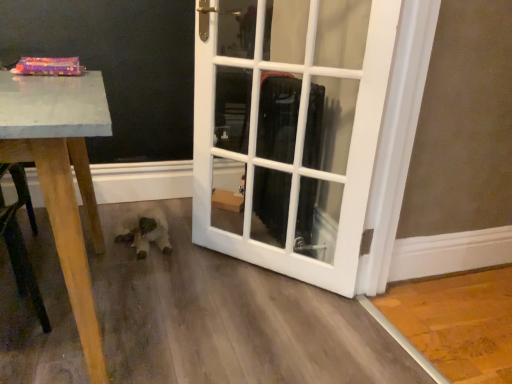
The width and height of the screenshot is (512, 384). I want to click on white glossy door at center, so click(x=289, y=130).

What do you see at coordinates (289, 130) in the screenshot? I see `white glossy door at center` at bounding box center [289, 130].

This screenshot has height=384, width=512. Identify the location of white plush toy at lower center. (144, 231).

Measure the distance between white plush toy at lower center and camera.

white plush toy at lower center is 5.92 feet from camera.

The image size is (512, 384). What do you see at coordinates (144, 231) in the screenshot?
I see `white plush toy at lower center` at bounding box center [144, 231].

What are the coordinates of `white glossy door at center` in the screenshot? It's located at (289, 130).

Between white plush toy at lower center and white glossy door at center, which one appears on the right side from the viewer's perspective?

From the viewer's perspective, white glossy door at center appears more on the right side.

Is the position of white plush toy at lower center less distant than that of white glossy door at center?

No, white plush toy at lower center is behind white glossy door at center.

Considering the points (162, 247) and (244, 18), which point is in front, point (162, 247) or point (244, 18)?

The point (162, 247) is closer.

From the image's perspective, relative to white glossy door at center, is white plush toy at lower center above or below?

Clearly, from the image's perspective, white plush toy at lower center is below white glossy door at center.

In the scene shown: From a real-world perspective, between white plush toy at lower center and white glossy door at center, who is vertically higher?

In real-world perspective, white glossy door at center is above.

Considering the sizes of objects white plush toy at lower center and white glossy door at center in the image provided, who is thinner, white plush toy at lower center or white glossy door at center?

Thinner between the two is white glossy door at center.

Considering the sizes of white plush toy at lower center and white glossy door at center in the image, is white plush toy at lower center taller or shorter than white glossy door at center?

In the image, white plush toy at lower center appears to be shorter than white glossy door at center.

Considering the sizes of objects white plush toy at lower center and white glossy door at center in the image provided, who is bigger, white plush toy at lower center or white glossy door at center?

Bigger between the two is white glossy door at center.

Is white plush toy at lower center surrounding white glossy door at center?

Definitely not — white glossy door at center is not inside white plush toy at lower center.

Are white plush toy at lower center and white glossy door at center far apart?

No, white plush toy at lower center is in close proximity to white glossy door at center.

Is white plush toy at lower center facing towards white glossy door at center?

No.

Can you tell me how much white plush toy at lower center and white glossy door at center differ in facing direction?

white plush toy at lower center and white glossy door at center are facing 47.8 degrees away from each other.

Measure the distance between white plush toy at lower center and white glossy door at center.

They are 25.52 inches apart.

The image size is (512, 384). In the image, there is a white glossy door at center. Find the location of `animal below it (from the image's perspective)`. animal below it (from the image's perspective) is located at coordinates (144, 231).

Can you confirm if white glossy door at center is positioned to the right of white plush toy at lower center?

Yes, white glossy door at center is to the right of white plush toy at lower center.

Which object is closer to the camera, white glossy door at center or white plush toy at lower center?

white glossy door at center.

Considering the positions of point (333, 209) and point (157, 217), is point (333, 209) closer or farther from the camera than point (157, 217)?

Point (333, 209) is positioned closer to the camera compared to point (157, 217).

From the image's perspective, is white glossy door at center located above or below white plush toy at lower center?

white glossy door at center is situated higher than white plush toy at lower center in the image.

From a real-world perspective, is white glossy door at center positioned under white plush toy at lower center based on gravity?

No.

Is white glossy door at center thinner than white plush toy at lower center?

Yes.

Is white glossy door at center taller or shorter than white plush toy at lower center?

Clearly, white glossy door at center is taller compared to white plush toy at lower center.

Considering the relative sizes of white glossy door at center and white plush toy at lower center in the image provided, is white glossy door at center smaller than white plush toy at lower center?

Actually, white glossy door at center might be larger than white plush toy at lower center.

Is white plush toy at lower center completely or partially inside white glossy door at center?

No, white plush toy at lower center is located outside of white glossy door at center.

Is there a large distance between white glossy door at center and white plush toy at lower center?

white glossy door at center is near white plush toy at lower center, not far away.

Is white glossy door at center looking in the opposite direction of white plush toy at lower center?

white glossy door at center does not have its back to white plush toy at lower center.

Consider the image. How different are the orientations of white glossy door at center and white plush toy at lower center in degrees?

white glossy door at center and white plush toy at lower center are facing 47.8 degrees away from each other.

The width and height of the screenshot is (512, 384). In the image, there is a white glossy door at center. Find the location of `animal below it (from a real-world perspective)`. animal below it (from a real-world perspective) is located at coordinates (144, 231).

There is a white plush toy at lower center. What are the coordinates of `door above it (from a real-world perspective)` in the screenshot? It's located at (289, 130).

I want to click on door above the white plush toy at lower center (from the image's perspective), so click(x=289, y=130).